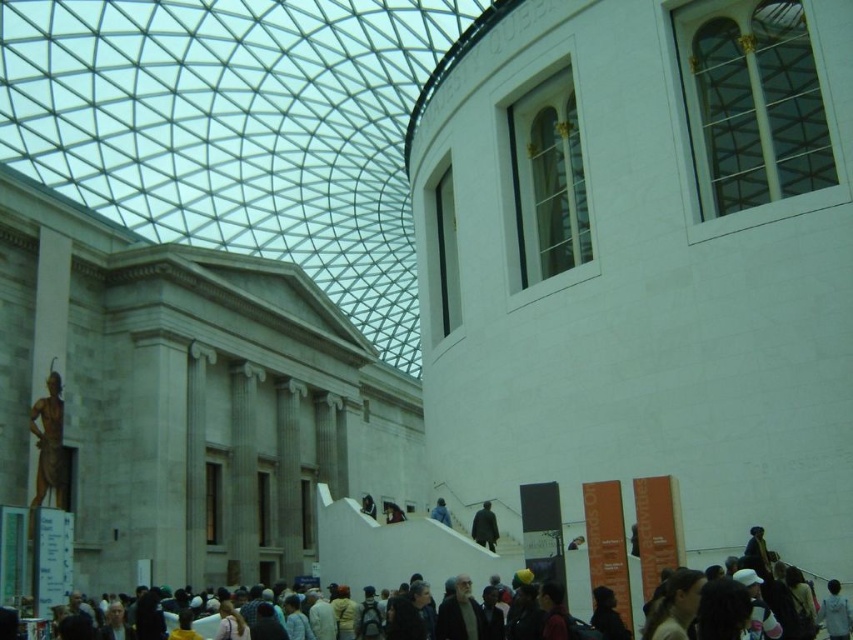
Between dark blue jacket at lower center and dark blue fabric at center, which one has more height?

With more height is dark blue fabric at center.

The width and height of the screenshot is (853, 640). Identify the location of dark blue jacket at lower center. (485, 525).

Can you confirm if gold metallic statue at left is positioned to the right of dark blue fabric at center?

Incorrect, gold metallic statue at left is not on the right side of dark blue fabric at center.

Does point (45, 472) come in front of point (364, 512)?

Yes, point (45, 472) is closer to viewer.

Describe the element at coordinates (48, 442) in the screenshot. I see `gold metallic statue at left` at that location.

Find the location of a particular element. This screenshot has height=640, width=853. gold metallic statue at left is located at coordinates (48, 442).

Is point (492, 532) behind point (440, 509)?

No, (492, 532) is in front of (440, 509).

This screenshot has height=640, width=853. Describe the element at coordinates (485, 525) in the screenshot. I see `dark blue jacket at lower center` at that location.

Locate an element on the screen. This screenshot has height=640, width=853. dark blue jacket at lower center is located at coordinates (485, 525).